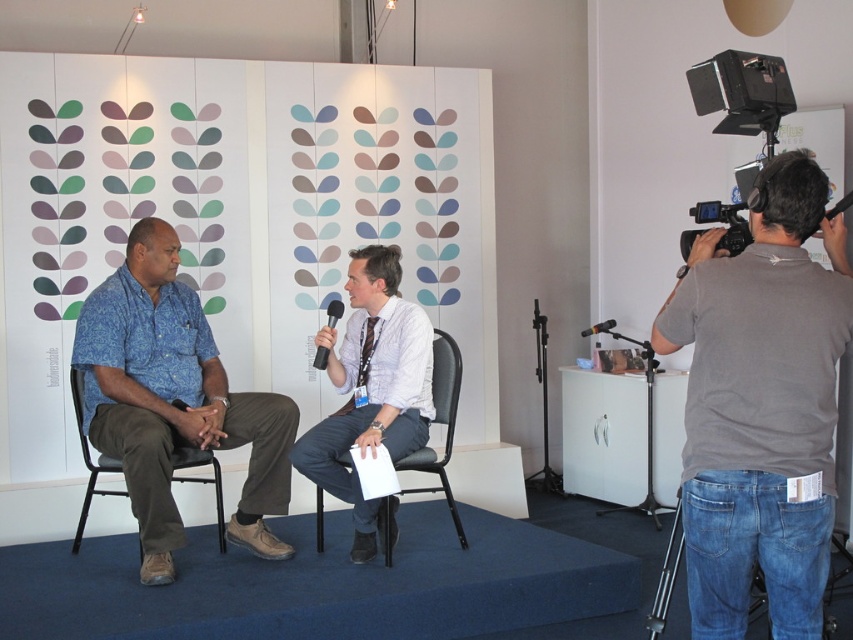
You are organizing a small event and need to place a rectangular table between the black plastic chair at center and the black matte microphone at upper right. The table must be 1.2 meters long. Can the space between them accommodate the table?

The black plastic chair at center is wider than the black matte microphone at upper right. However, the description only provides information about their widths, not the distance between them. Without knowing the distance between the two objects, it is impossible to determine if the 1.2 meter table will fit.

You are a photographer setting up for an interview. You want to ensure that the black plastic chair at center is in focus while the backdrop remains slightly blurred. Based on the scene description, what is the minimum distance you should set between the camera and the chair to achieve this effect?

The black plastic chair at center is 3.30 meters from the camera. To keep the chair in focus and blur the backdrop, the camera should be positioned at least 3.30 meters away from the chair.

You are a photographer setting up for an interview. You have two points marked on your camera screen at coordinates point (712, 244) and point (705, 218). You need to place a microphone stand such that it is closer to the front point. Which coordinate should you aim for?

Point (712, 244) is in front of point (705, 218), so you should aim for point (712, 244) to place the microphone stand closer to the front point.